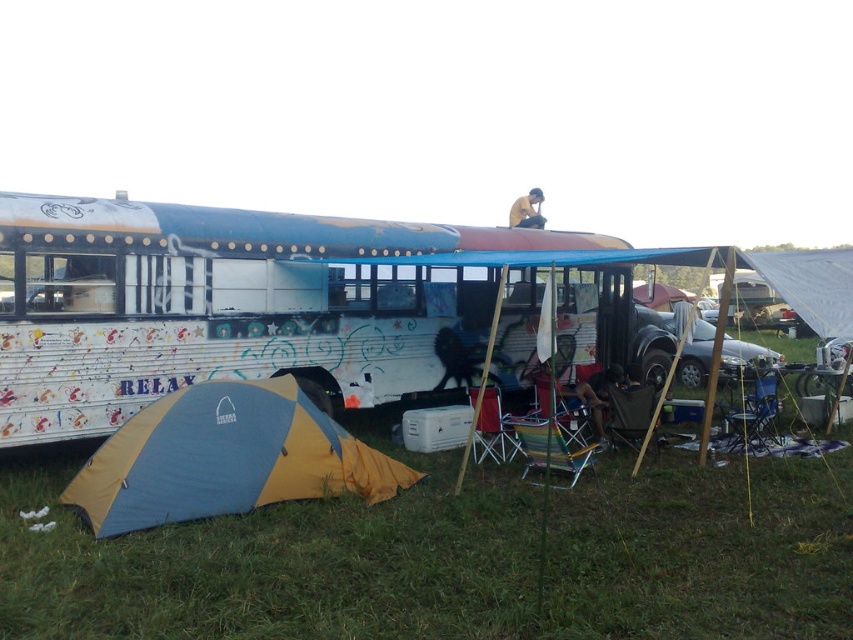
Can you confirm if white painted bus at center is positioned below yellow fabric at upper center?

Yes.

Who is shorter, white painted bus at center or yellow fabric at upper center?

white painted bus at center

Measure the distance between white painted bus at center and camera.

7.39 meters

Locate an element on the screen. white painted bus at center is located at coordinates [x=262, y=305].

Who is lower down, white painted bus at center or yellow/blue fabric tent at lower left?

yellow/blue fabric tent at lower left is lower down.

Which is in front, point (218, 211) or point (141, 472)?

Point (141, 472) is in front.

Where is `white painted bus at center`? white painted bus at center is located at coordinates (262, 305).

Can you confirm if yellow/blue fabric tent at lower left is wider than yellow fabric at upper center?

Incorrect, yellow/blue fabric tent at lower left's width does not surpass yellow fabric at upper center's.

Can you confirm if yellow/blue fabric tent at lower left is thinner than yellow fabric at upper center?

Indeed, yellow/blue fabric tent at lower left has a lesser width compared to yellow fabric at upper center.

Does point (175, 486) lie behind point (535, 204)?

No, (175, 486) is closer to viewer.

Locate an element on the screen. This screenshot has height=640, width=853. yellow/blue fabric tent at lower left is located at coordinates (225, 458).